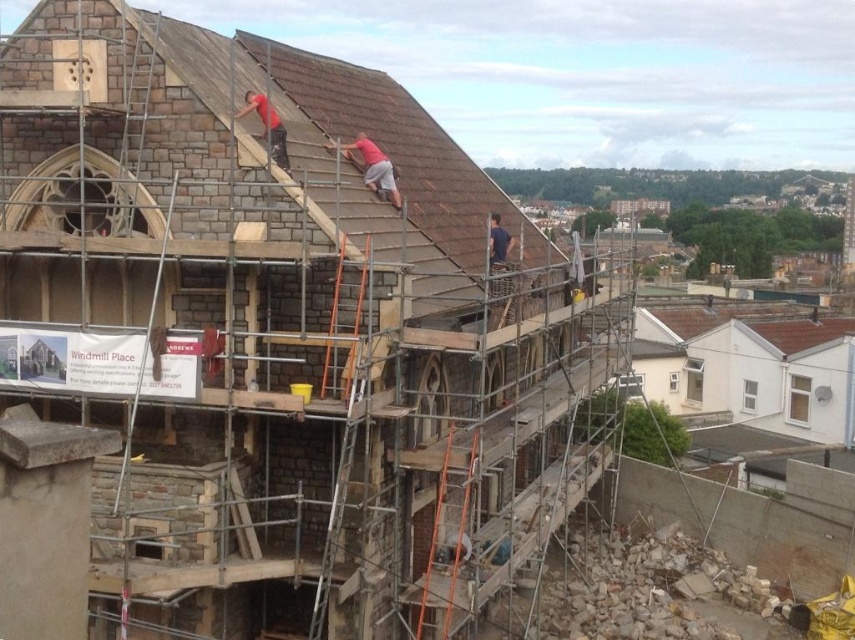
Is brown tile roof at upper center to the right of matte red shirt at upper center from the viewer's perspective?

Correct, you'll find brown tile roof at upper center to the right of matte red shirt at upper center.

Who is taller, brown tile roof at upper center or matte red shirt at upper center?

With more height is brown tile roof at upper center.

Find the location of a particular element. brown tile roof at upper center is located at coordinates (363, 129).

Between brown tile roof at upper center and red matte shirt at upper center, which one has less height?

red matte shirt at upper center is shorter.

Between brown tile roof at upper center and red matte shirt at upper center, which one is positioned lower?

Positioned lower is red matte shirt at upper center.

Is point (475, 189) less distant than point (258, 96)?

No, it is behind (258, 96).

Locate an element on the screen. brown tile roof at upper center is located at coordinates (363, 129).

Does matte red shirt at upper center appear under red matte shirt at upper center?

Correct, matte red shirt at upper center is located below red matte shirt at upper center.

The height and width of the screenshot is (640, 855). I want to click on matte red shirt at upper center, so click(372, 166).